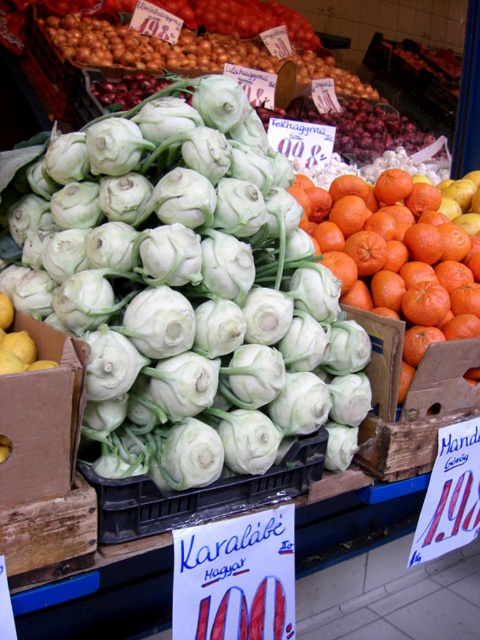
What do you see at coordinates (184, 289) in the screenshot? I see `white matte kohlrabi at center` at bounding box center [184, 289].

Is white matte kohlrabi at center to the left of yellow cardboard box at center-left from the viewer's perspective?

In fact, white matte kohlrabi at center is to the right of yellow cardboard box at center-left.

The height and width of the screenshot is (640, 480). I want to click on white matte kohlrabi at center, so click(x=184, y=289).

What do you see at coordinates (41, 417) in the screenshot? I see `yellow cardboard box at center-left` at bounding box center [41, 417].

Measure the distance between yellow cardboard box at center-left and camera.

76.23 centimeters

Identify the location of yellow cardboard box at center-left. (41, 417).

Does white matte kohlrabi at center appear on the right side of green leafy kohlrabi at center?

In fact, white matte kohlrabi at center is to the left of green leafy kohlrabi at center.

How far apart are white matte kohlrabi at center and green leafy kohlrabi at center?

white matte kohlrabi at center is 6.59 feet away from green leafy kohlrabi at center.

This screenshot has width=480, height=640. What are the coordinates of `white matte kohlrabi at center` in the screenshot? It's located at (184, 289).